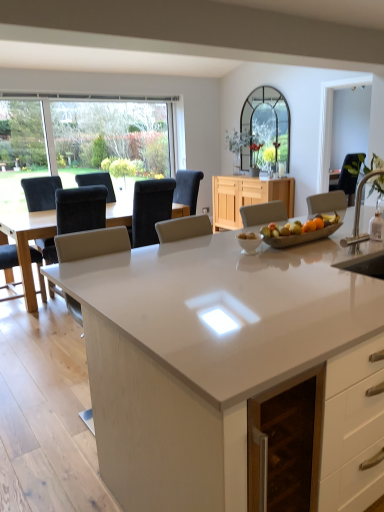
The width and height of the screenshot is (384, 512). What do you see at coordinates (80, 209) in the screenshot? I see `matte black chair at left, the 2th chair when ordered from left to right` at bounding box center [80, 209].

Measure the distance between matte black chair at left, arranged as the 4th chair when viewed from the right, and camera.

12.93 feet.

Describe the element at coordinates (112, 134) in the screenshot. I see `transparent glass window at upper left` at that location.

Locate an element on the screen. This screenshot has height=512, width=384. white glossy countertop at center is located at coordinates (226, 366).

Find the location of a particular element. matte black chair at left, the 2th chair when ordered from left to right is located at coordinates (80, 209).

Is white glossy bowl at center in front of or behind matte black chair at left, which is the first chair from left to right, in the image?

In the image, white glossy bowl at center appears in front of matte black chair at left, which is the first chair from left to right.

Does white glossy bowl at center appear on the right side of matte black chair at left, which is the first chair from left to right?

Yes, white glossy bowl at center is to the right of matte black chair at left, which is the first chair from left to right.

Find the location of `bowl lying in front of the matte black chair at left, arranged as the 4th chair when viewed from the right`. bowl lying in front of the matte black chair at left, arranged as the 4th chair when viewed from the right is located at coordinates (249, 242).

From the matte black chair at left, which is the first chair from left to right, count 2nd chairs forward and point to it. Please provide its 2D coordinates.

[(348, 177)]

Consider the image. Is the depth of black fabric chair at right, which is the 1th chair from right to left, greater than that of matte black chair at left, arranged as the 4th chair when viewed from the right?

No, the depth of black fabric chair at right, which is the 1th chair from right to left, is less than that of matte black chair at left, arranged as the 4th chair when viewed from the right.

Could you measure the distance between black fabric chair at right, which ranks as the 4th chair in left-to-right order, and matte black chair at left, which is the first chair from left to right?

A distance of 4.01 meters exists between black fabric chair at right, which ranks as the 4th chair in left-to-right order, and matte black chair at left, which is the first chair from left to right.

Is black fabric chair at right, which is the 1th chair from right to left, positioned with its back to matte black chair at left, arranged as the 4th chair when viewed from the right?

No, black fabric chair at right, which is the 1th chair from right to left, is not facing the opposite direction of matte black chair at left, arranged as the 4th chair when viewed from the right.

Measure the distance from wooden bowl of mixed fruits at center to transparent glass window at upper left.

wooden bowl of mixed fruits at center is 4.54 meters away from transparent glass window at upper left.

Identify the location of fruit that is below the transparent glass window at upper left (from the image's perspective). (300, 227).

Is wooden bowl of mixed fruits at center looking in the opposite direction of transparent glass window at upper left?

No, wooden bowl of mixed fruits at center is not facing away from transparent glass window at upper left.

Which is in front, point (278, 228) or point (16, 93)?

The point (278, 228) is closer.

From a real-world perspective, is matte black chair at left, the 2th chair when ordered from left to right, physically located above or below light wood cabinet at center?

matte black chair at left, the 2th chair when ordered from left to right, is above light wood cabinet at center.

From the image's perspective, is matte black chair at left, positioned as the third chair in right-to-left order, below light wood cabinet at center?

Indeed, from the image's perspective, matte black chair at left, positioned as the third chair in right-to-left order, is shown beneath light wood cabinet at center.

Between point (84, 206) and point (239, 184), which one is positioned behind?

The point (239, 184) is farther from the camera.

Which object is wider, matte black chair at left, the 2th chair when ordered from left to right, or light wood cabinet at center?

Wider between the two is matte black chair at left, the 2th chair when ordered from left to right.

Does wooden bowl of mixed fruits at center appear on the left side of matte black chair at left, arranged as the 4th chair when viewed from the right?

No, wooden bowl of mixed fruits at center is not to the left of matte black chair at left, arranged as the 4th chair when viewed from the right.

There is a matte black chair at left, arranged as the 4th chair when viewed from the right. At what (x,y) coordinates should I click in order to perform the action: click on fruit above it (from a real-world perspective). Please return your answer as a coordinate pair (x, y). The image size is (384, 512). Looking at the image, I should click on (300, 227).

In terms of height, does wooden bowl of mixed fruits at center look taller or shorter compared to matte black chair at left, arranged as the 4th chair when viewed from the right?

In the image, wooden bowl of mixed fruits at center appears to be shorter than matte black chair at left, arranged as the 4th chair when viewed from the right.

Which point is more forward, (299,232) or (12,245)?

The point (299,232) is more forward.

Which of these two, light wood cabinet at center or black fabric chair at center, marked as the 3th chair in a left-to-right arrangement, is wider?

Result: black fabric chair at center, marked as the 3th chair in a left-to-right arrangement, is wider.

From the image's perspective, which is below, light wood cabinet at center or black fabric chair at center, which is counted as the 2th chair, starting from the right?

black fabric chair at center, which is counted as the 2th chair, starting from the right, appears lower in the image.

Is light wood cabinet at center positioned far away from black fabric chair at center, marked as the 3th chair in a left-to-right arrangement?

light wood cabinet at center is near black fabric chair at center, marked as the 3th chair in a left-to-right arrangement, not far away.

Which object is closer to the camera, white glossy countertop at center or wooden bowl of mixed fruits at center?

white glossy countertop at center is in front.

Which is more to the left, white glossy countertop at center or wooden bowl of mixed fruits at center?

Positioned to the left is wooden bowl of mixed fruits at center.

Locate an element on the screen. This screenshot has height=512, width=384. fruit located behind the white glossy countertop at center is located at coordinates (300, 227).

Is white glossy countertop at center inside or outside of wooden bowl of mixed fruits at center?

Answer: white glossy countertop at center is located beyond the bounds of wooden bowl of mixed fruits at center.

Find the location of a particular element. The height and width of the screenshot is (512, 384). chair that is the 3rd one below the white glossy bowl at center (from a real-world perspective) is located at coordinates (8, 260).

From the image's perspective, which chair is the 2nd one above the matte black chair at left, which is the first chair from left to right? Please provide its 2D coordinates.

[(348, 177)]

Estimate the real-world distances between objects in this image. Which object is closer to white glossy countertop at center, black fabric chair at center, marked as the 3th chair in a left-to-right arrangement, or matte black chair at left, positioned as the third chair in right-to-left order?

matte black chair at left, positioned as the third chair in right-to-left order, is positioned closer to the anchor white glossy countertop at center.

Consider the image. When comparing their distances from black fabric chair at center, marked as the 3th chair in a left-to-right arrangement, does satin nickel faucet at right or wooden bowl of mixed fruits at center seem further?

satin nickel faucet at right is further to black fabric chair at center, marked as the 3th chair in a left-to-right arrangement.

Considering their positions, is light wood cabinet at center positioned further to matte black chair at left, arranged as the 4th chair when viewed from the right, than matte black chair at left, positioned as the third chair in right-to-left order?

Based on the image, light wood cabinet at center appears to be further to matte black chair at left, arranged as the 4th chair when viewed from the right.

Looking at this image, considering their positions, is matte black chair at left, positioned as the third chair in right-to-left order, positioned closer to transparent glass window at upper left than white glossy countertop at center?

Among the two, matte black chair at left, positioned as the third chair in right-to-left order, is located nearer to transparent glass window at upper left.

Based on the photo, looking at the image, which one is located further to matte black chair at left, which is the first chair from left to right, white glossy countertop at center or white glossy bowl at center?

Among the two, white glossy countertop at center is located further to matte black chair at left, which is the first chair from left to right.

Looking at the image, which one is located further to black fabric chair at right, which ranks as the 4th chair in left-to-right order, wooden bowl of mixed fruits at center or matte black chair at left, the 2th chair when ordered from left to right?

matte black chair at left, the 2th chair when ordered from left to right.

In the scene shown: Based on their spatial positions, is wooden bowl of mixed fruits at center or white glossy bowl at center further from transparent glass window at upper left?

white glossy bowl at center is positioned further to the anchor transparent glass window at upper left.

Looking at the image, which one is located closer to white glossy bowl at center, black fabric chair at center, which is counted as the 2th chair, starting from the right, or black fabric chair at right, which is the 1th chair from right to left?

Among the two, black fabric chair at center, which is counted as the 2th chair, starting from the right, is located nearer to white glossy bowl at center.

I want to click on sink between matte black chair at left, positioned as the third chair in right-to-left order, and black fabric chair at right, which ranks as the 4th chair in left-to-right order, so click(361, 243).

The width and height of the screenshot is (384, 512). Find the location of `fruit positioned between white glossy countertop at center and black fabric chair at right, which is the 1th chair from right to left, from near to far`. fruit positioned between white glossy countertop at center and black fabric chair at right, which is the 1th chair from right to left, from near to far is located at coordinates (300, 227).

The image size is (384, 512). What are the coordinates of `fruit between satin nickel faucet at right and black fabric chair at center, marked as the 3th chair in a left-to-right arrangement, along the z-axis` in the screenshot? It's located at (300, 227).

Image resolution: width=384 pixels, height=512 pixels. Identify the location of fruit located between white glossy countertop at center and black fabric chair at center, marked as the 3th chair in a left-to-right arrangement, in the depth direction. (300, 227).